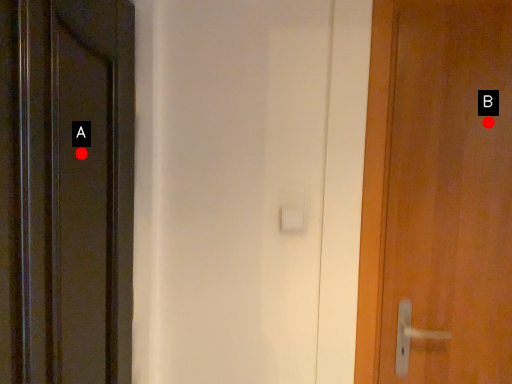
Question: Two points are circled on the image, labeled by A and B beside each circle. Among these points, which one is nearest to the camera?

Choices:
 (A) A is closer
 (B) B is closer

Answer: (A)